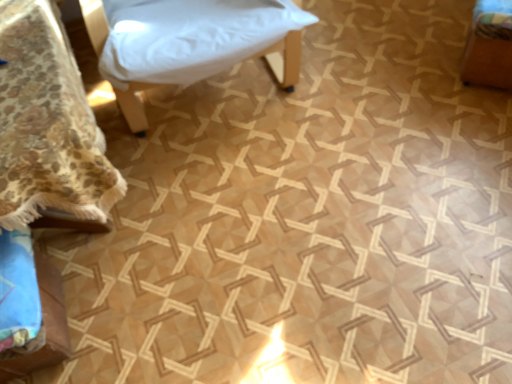
You are a GUI agent. You are given a task and a screenshot of the screen. Output one action in this format:
    pyautogui.click(x=<x>, y=<y>)
    Task: Click on the vacant space underneath white fabric cushion at upper center, which is counted as the second furniture, starting from the right (from a real-world perspective)
    The image size is (512, 384).
    Given the screenshot: What is the action you would take?
    pos(217,94)